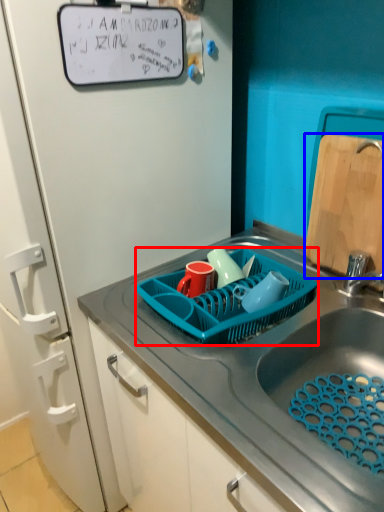
Question: Which point is further to the camera, basket (highlighted by a red box) or cutting board (highlighted by a blue box)?

Choices:
 (A) basket
 (B) cutting board

Answer: (B)